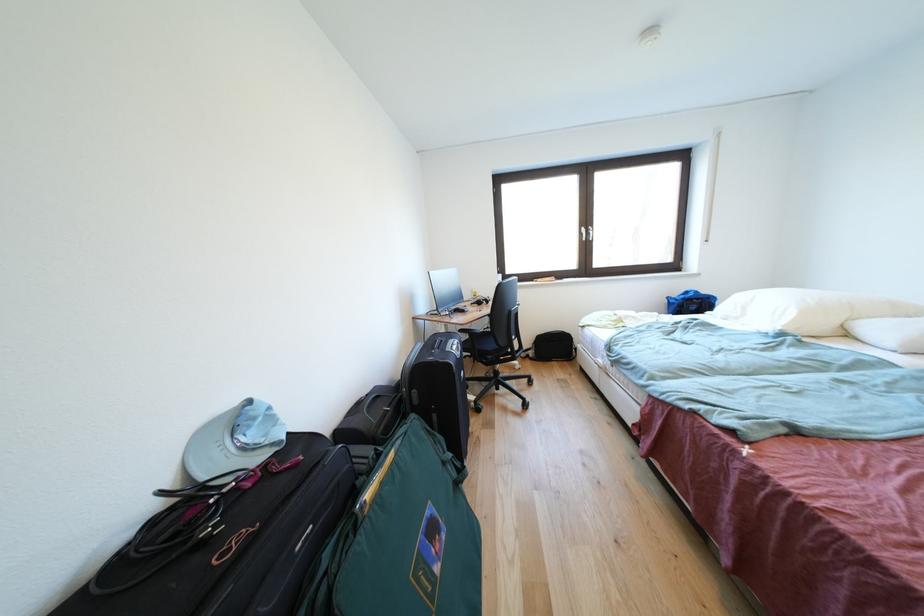
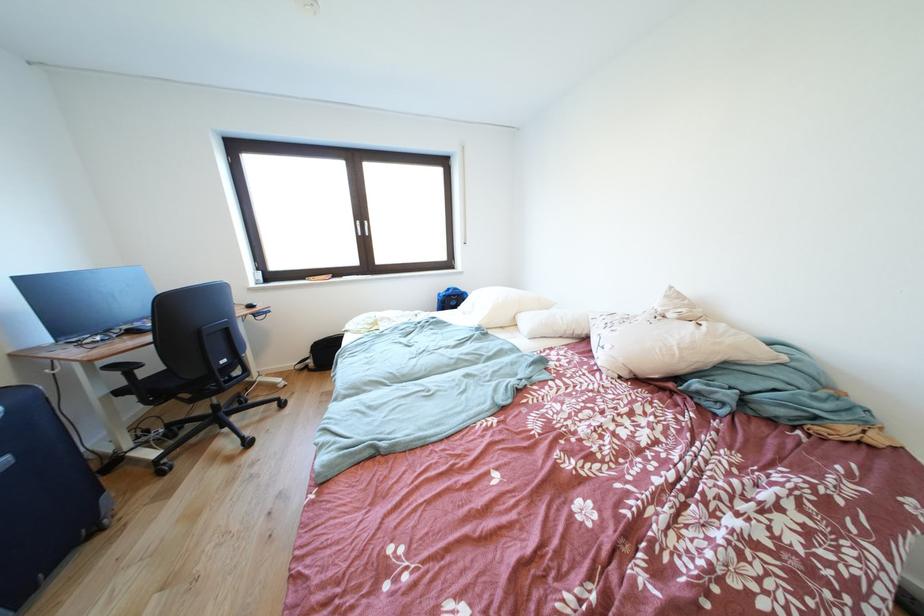
In the second image, find the point that corresponds to pixel 536 360 in the first image.

(315, 371)